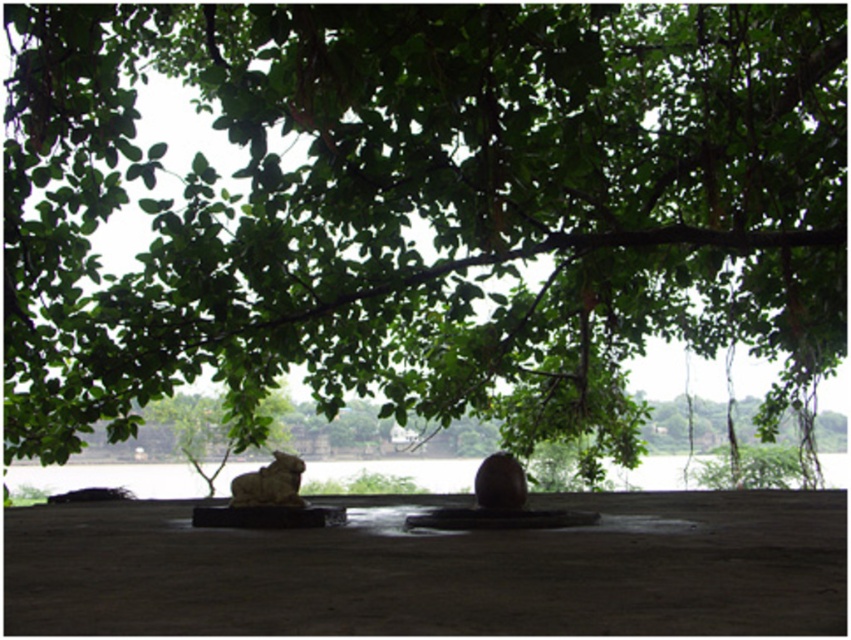
You are a landscape architect designing a garden pathway. You need to place a new decorative item between the gray stone statue at center and the matte brown stone at center. Given their sizes, which object should you place closer to the pathway to ensure it doesn

The gray stone statue at center is wider than the matte brown stone at center. To ensure the pathway is not obstructed, the matte brown stone at center should be placed closer to the pathway since it is narrower.

You are standing in the outdoor scene and want to place a small flag on the tallest object. Which object should you choose between the clear water at center and the gray stone statue at center?

The clear water at center is taller than the gray stone statue at center, so you should place the small flag on the clear water at center.